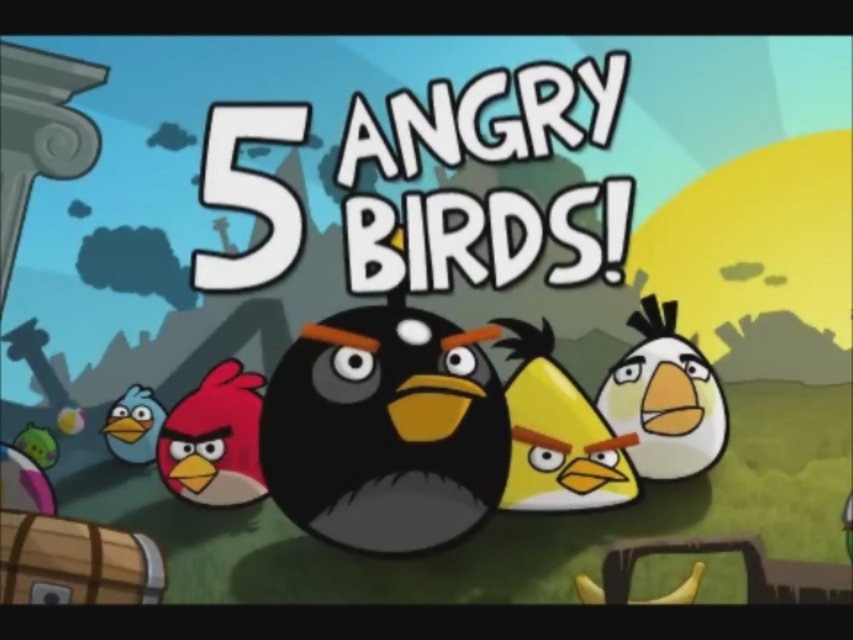
Does white matte bird at center right have a larger size compared to matte pink bird at left?

Indeed, white matte bird at center right has a larger size compared to matte pink bird at left.

This screenshot has width=853, height=640. Describe the element at coordinates (665, 397) in the screenshot. I see `white matte bird at center right` at that location.

You are a GUI agent. You are given a task and a screenshot of the screen. Output one action in this format:
    pyautogui.click(x=<x>, y=<y>)
    Task: Click on the white matte bird at center right
    Image resolution: width=853 pixels, height=640 pixels.
    Given the screenshot: What is the action you would take?
    pyautogui.click(x=665, y=397)

Which is more to the right, black matte bird at center or matte pink bird at left?

black matte bird at center

Between black matte bird at center and matte pink bird at left, which one has less height?

matte pink bird at left is shorter.

You are a GUI agent. You are given a task and a screenshot of the screen. Output one action in this format:
    pyautogui.click(x=<x>, y=<y>)
    Task: Click on the black matte bird at center
    
    Given the screenshot: What is the action you would take?
    pyautogui.click(x=384, y=432)

You are a GUI agent. You are given a task and a screenshot of the screen. Output one action in this format:
    pyautogui.click(x=<x>, y=<y>)
    Task: Click on the black matte bird at center
    
    Given the screenshot: What is the action you would take?
    pyautogui.click(x=384, y=432)

Can you confirm if black matte bird at center is positioned below white matte bird at center right?

Yes.

Is black matte bird at center behind white matte bird at center right?

That is True.

Which is in front, point (502, 449) or point (633, 355)?

Point (633, 355)

The height and width of the screenshot is (640, 853). In order to click on black matte bird at center in this screenshot , I will do `click(384, 432)`.